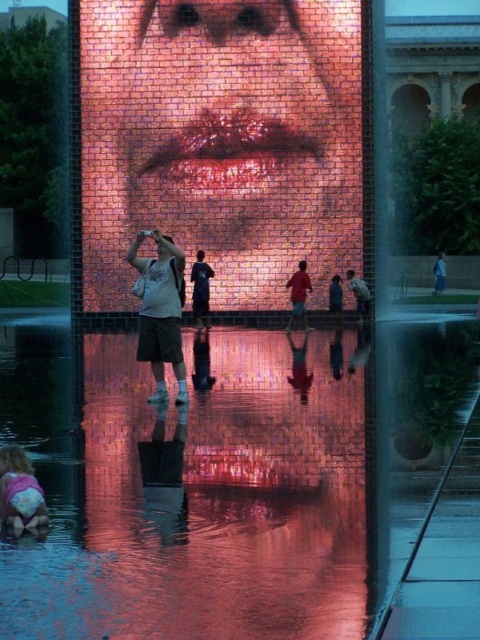
You are standing in front of the digital art installation and see the point at coordinates (299, 292). What object is located at this point?

The point at coordinates (299, 292) corresponds to the matte red shirt at center.

You are standing in front of the art installation and want to take a photo of both the pink fabric at lower left and the matte red shirt at center without any obstruction. Can you position yourself in a way that both objects are visible in the frame without one blocking the other?

The pink fabric at lower left is in front of the matte red shirt at center, so you cannot position yourself to see both without one blocking the other. You would need to move around to find an angle where the pink fabric at lower left is not directly in front of the matte red shirt at center.

You are standing in front of the digital art installation and notice two items in the scene. The pink fabric at lower left and the matte red shirt at center. Which one is located more to the left side?

The pink fabric at lower left is more to the left side.